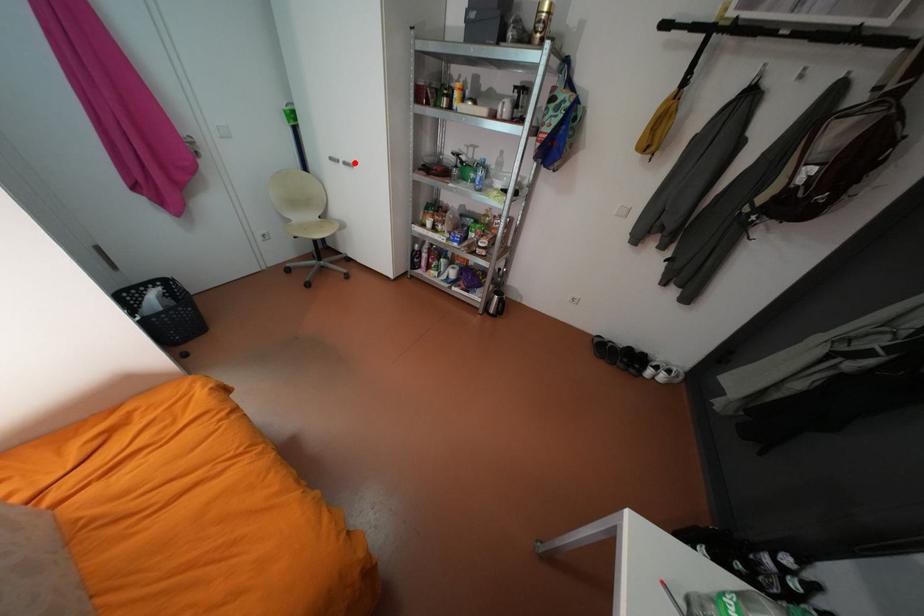
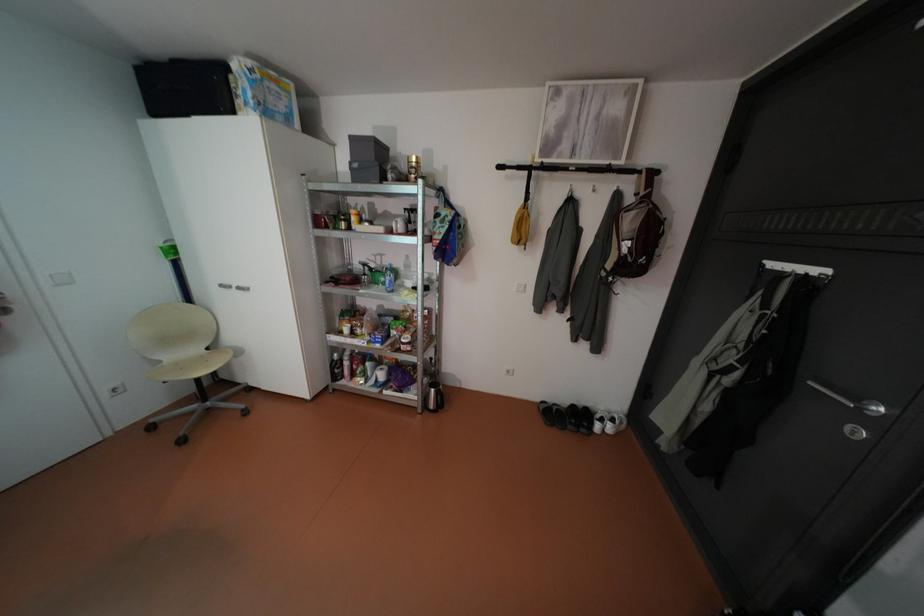
In the second image, find the point that corresponds to the highlighted location in the first image.

(248, 286)